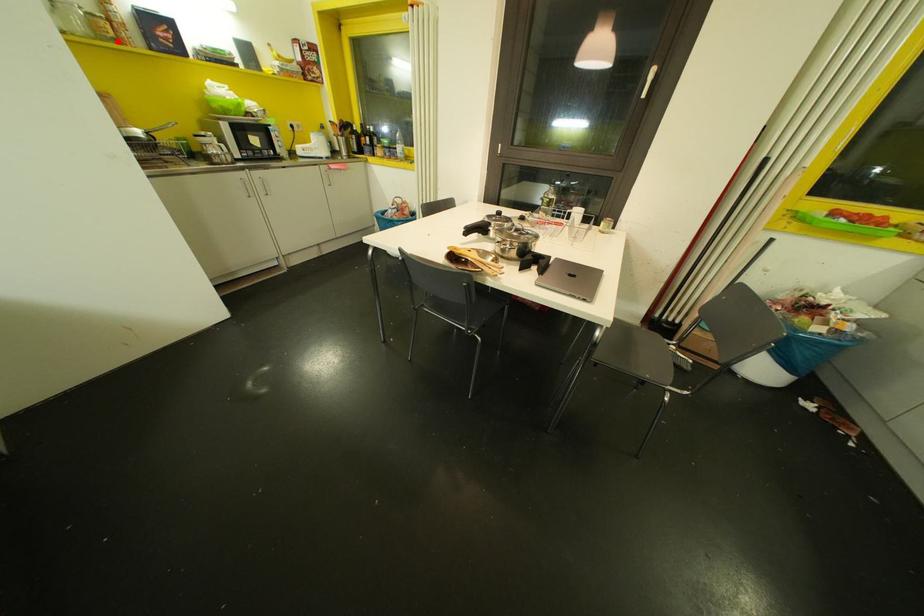
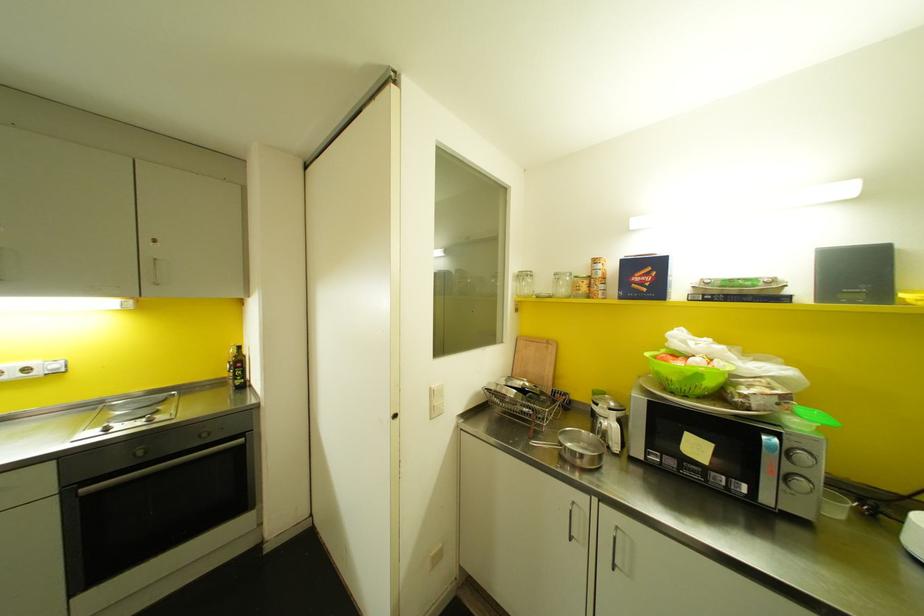
Find the pixel in the second image that matches the highlighted location in the first image.

(588, 294)